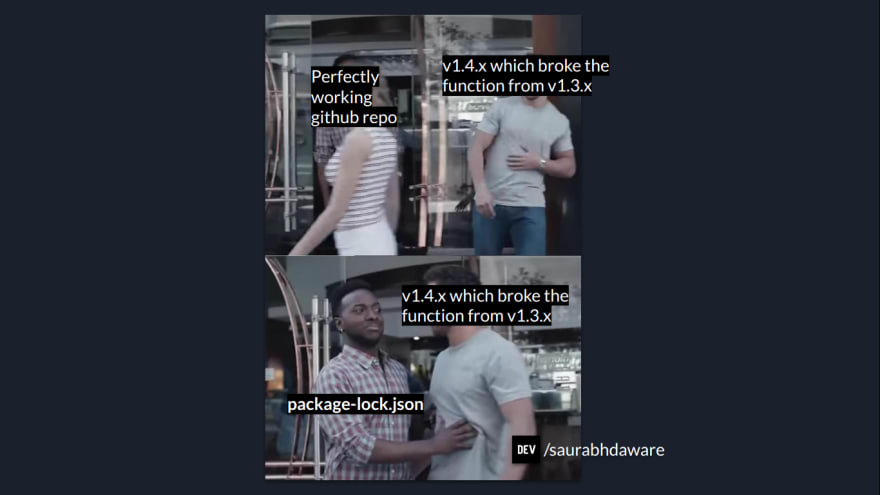
Image resolution: width=880 pixels, height=495 pixels. In order to click on door in this screenshot , I will do click(433, 202).